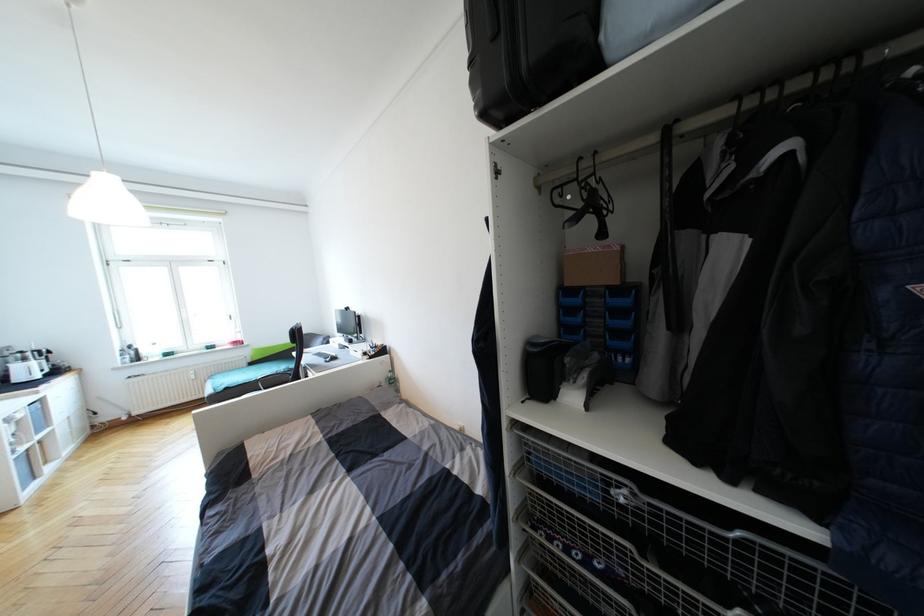
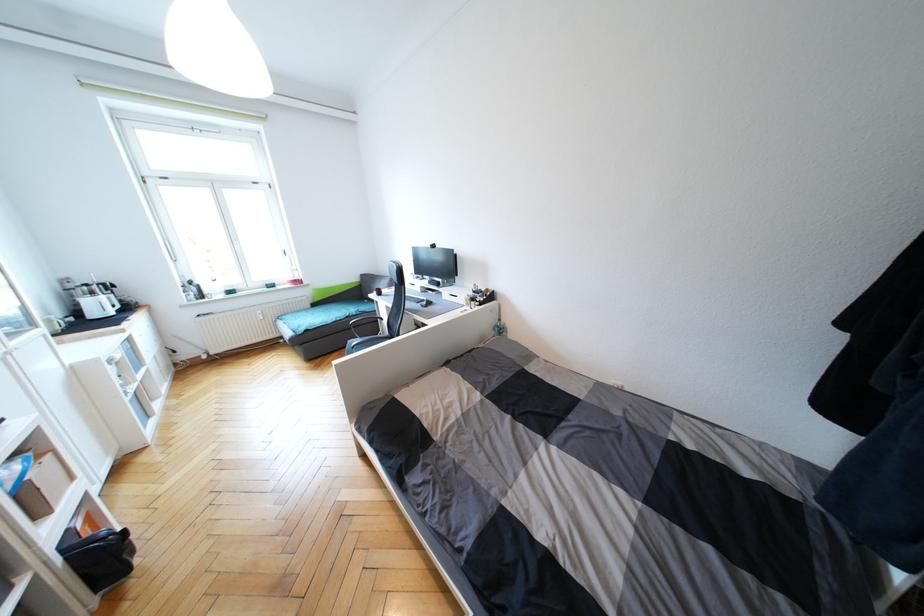
Question: In a continuous first-person perspective shot, in which direction is the camera moving?

Choices:
 (A) Left
 (B) Right
 (C) Forward
 (D) Backward

Answer: (A)